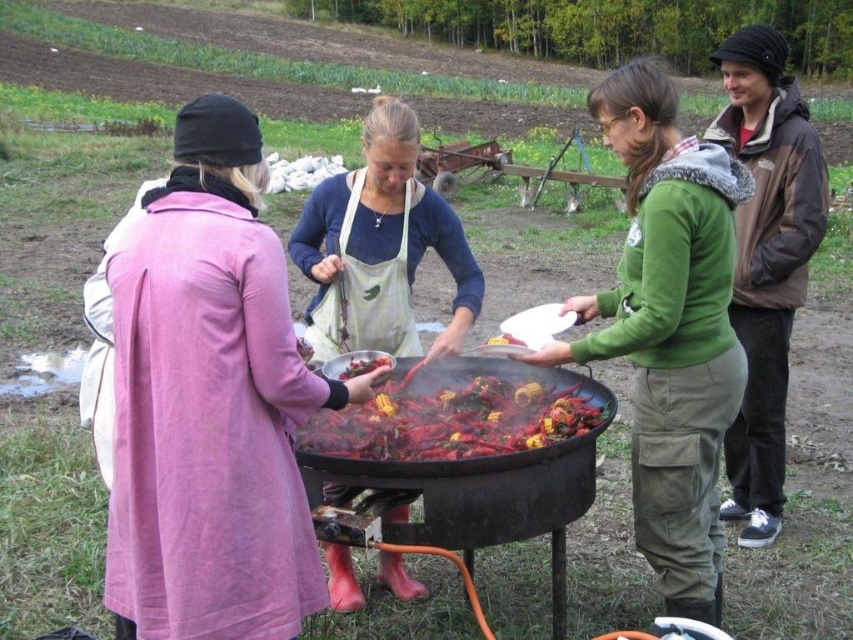
You are standing in the countryside scene looking at the large black cooking pot. Where is the brown woolen hat at upper right located in relation to the pot?

The brown woolen hat at upper right is located at the upper right area of the image, specifically at coordinates approximately 0.408 on the x and 0.899 on the y axis.

From the picture: You are standing in the countryside scene and want to hand the shiny red berries at center to the person in the pink fabric coat at center. Can you directly hand them without moving either object?

The pink fabric coat at center is closer to the viewer than the shiny red berries at center, so you can directly hand the berries to the person in the pink fabric coat at center since they are closer to you.